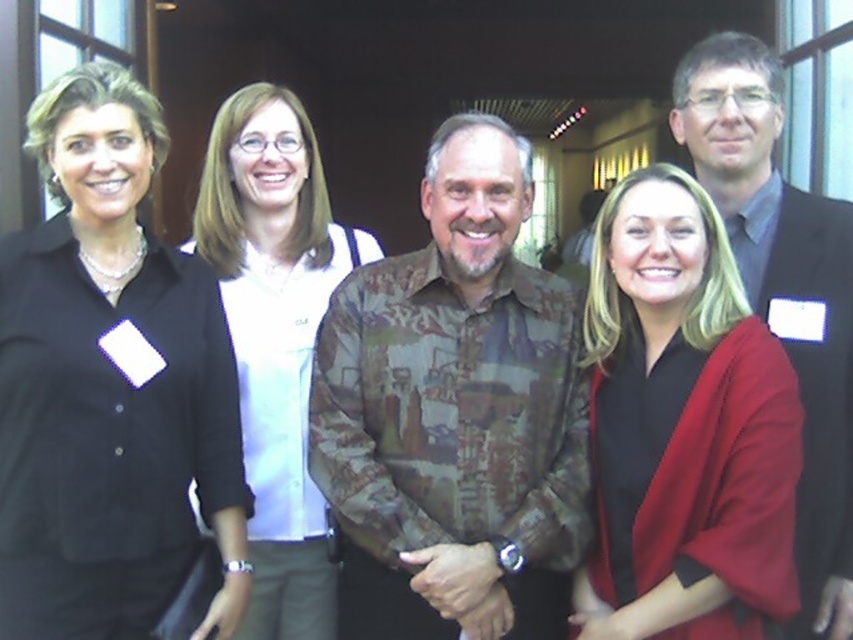
You are a photographer adjusting the lighting in the studio. You need to ensure that the matte black blazer at center and the white matte shirt at center are evenly lit. Given their current distance apart, can you estimate whether the lighting setup will require adjustment to balance the exposure between them?

The matte black blazer at center is 1.20 meters away from the white matte shirt at center. Since the distance between them is moderate, the lighting setup might need adjustment to ensure both receive balanced exposure, especially considering the difference in color and reflectivity between the black blazer and white shirt.